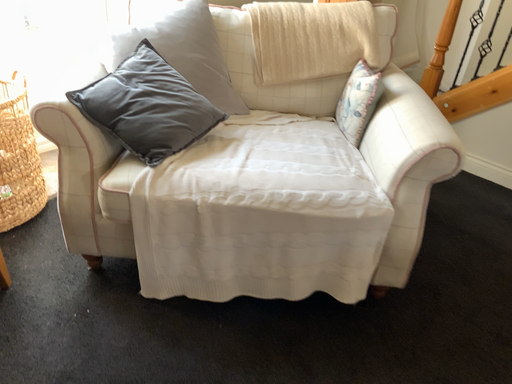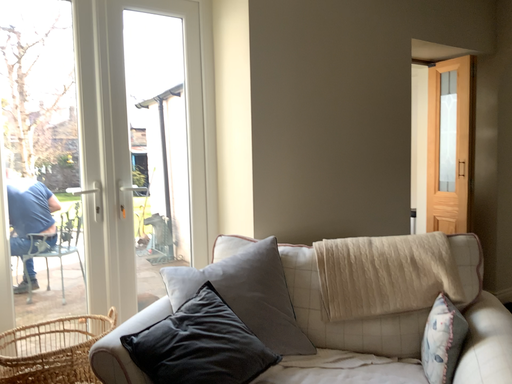
Question: Which way did the camera rotate in the video?

Choices:
 (A) rotated downward
 (B) rotated upward

Answer: (B)